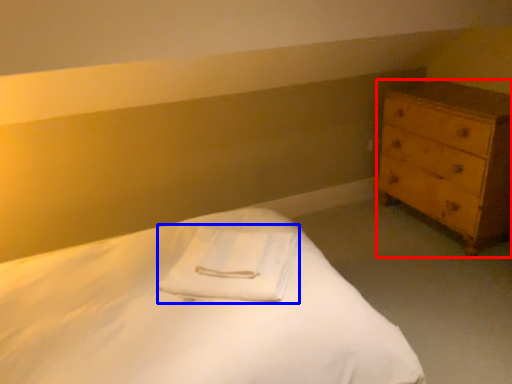
Question: Which of the following is the farthest to the observer, chest of drawers (highlighted by a red box) or cloth (highlighted by a blue box)?

Choices:
 (A) chest of drawers
 (B) cloth

Answer: (A)